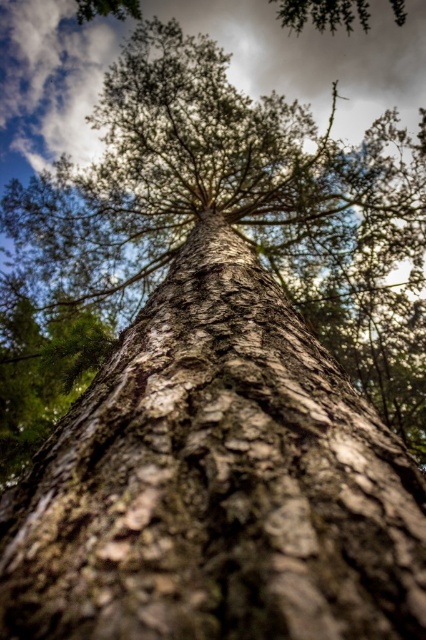
Question: Considering the relative positions of brown rough bark tree trunk at center and white fluffy cloud at upper center in the image provided, where is brown rough bark tree trunk at center located with respect to white fluffy cloud at upper center?

Choices:
 (A) right
 (B) left

Answer: (B)

Question: Which point is closer to the camera?

Choices:
 (A) brown rough bark tree trunk at center
 (B) white fluffy cloud at upper center

Answer: (A)

Question: Considering the relative positions of brown rough bark tree trunk at center and white fluffy cloud at upper center in the image provided, where is brown rough bark tree trunk at center located with respect to white fluffy cloud at upper center?

Choices:
 (A) right
 (B) left

Answer: (B)

Question: Is brown rough bark tree trunk at center behind white fluffy cloud at upper center?

Choices:
 (A) no
 (B) yes

Answer: (A)